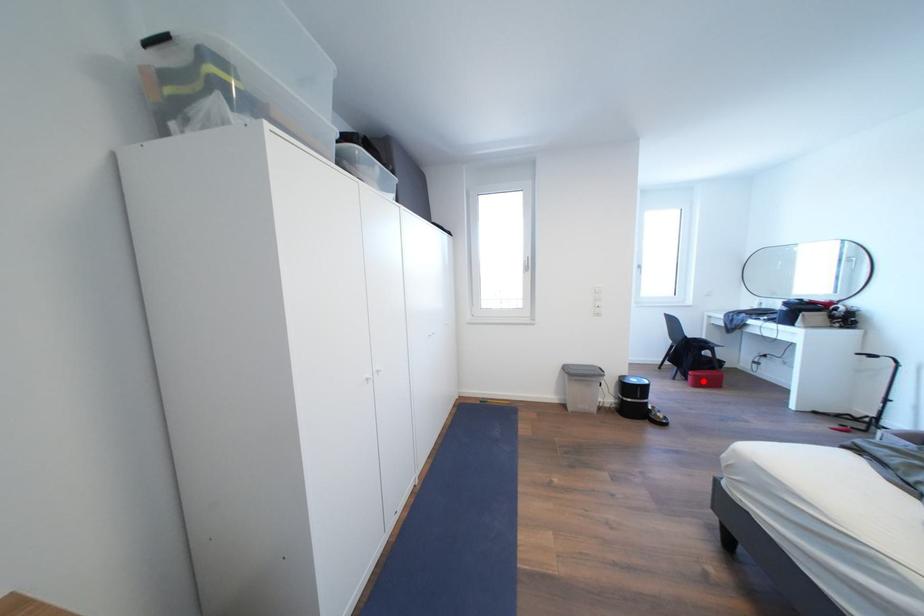
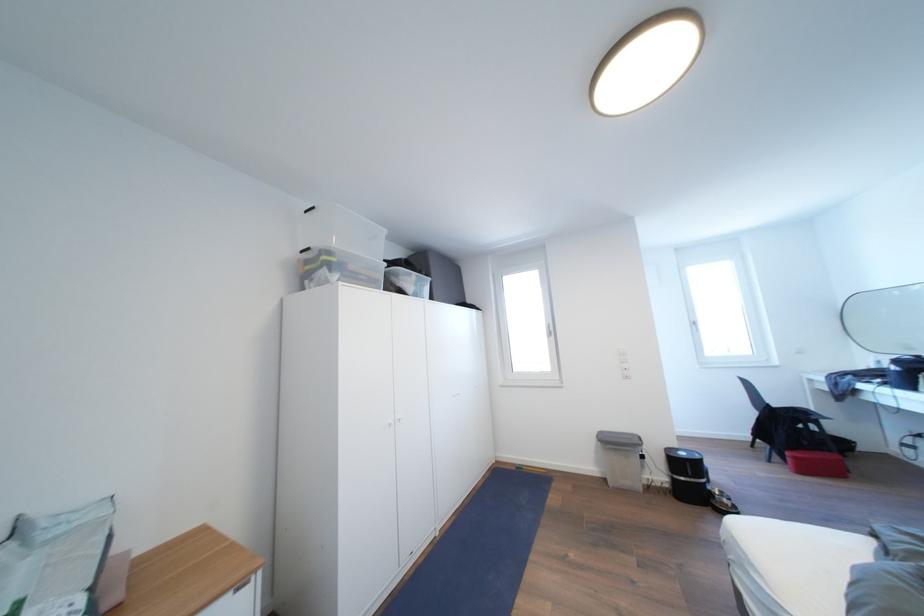
In the second image, find the point that corresponds to the highlighted location in the first image.

(803, 463)